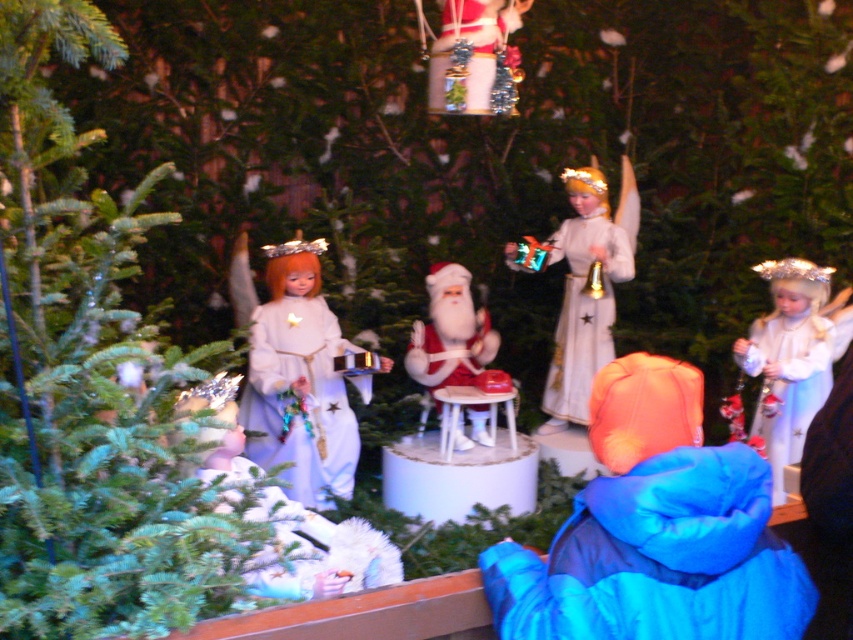
Where is `white glossy angel at center`? This screenshot has width=853, height=640. white glossy angel at center is located at coordinates (585, 288).

Between white glossy angel at center and white matte angel at lower left, which one is positioned higher?

Positioned higher is white glossy angel at center.

Who is more forward, (619,273) or (192,400)?

Point (192,400) is in front.

In order to click on white glossy angel at center in this screenshot , I will do `click(585, 288)`.

Does shiny silver ornament at upper center appear on the left side of matte red santa at center?

In fact, shiny silver ornament at upper center is to the right of matte red santa at center.

Between point (440, 67) and point (485, 442), which one is positioned in front?

Point (440, 67) is more forward.

Between point (498, 1) and point (456, 449), which one is positioned in front?

Point (498, 1)

This screenshot has width=853, height=640. I want to click on shiny silver ornament at upper center, so click(x=474, y=58).

Who is shorter, blue puffy jacket at center or matte red santa at center?

With less height is blue puffy jacket at center.

Which is below, blue puffy jacket at center or matte red santa at center?

blue puffy jacket at center

Does point (735, 532) come closer to viewer compared to point (483, 412)?

Yes.

The image size is (853, 640). Identify the location of blue puffy jacket at center. (654, 531).